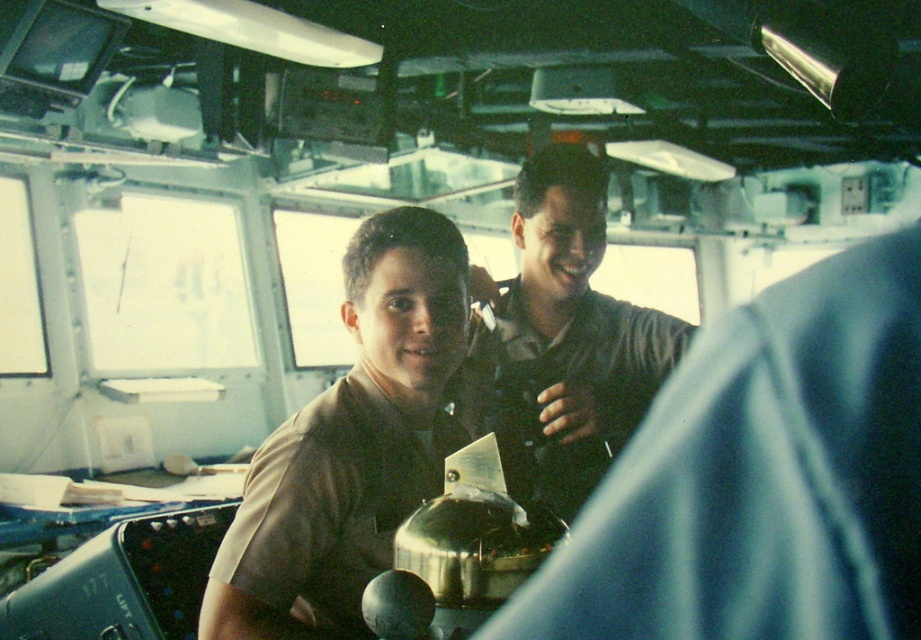
Question: Does matte brown shirt at center have a smaller size compared to dark brown uniform at center?

Choices:
 (A) yes
 (B) no

Answer: (A)

Question: Which point is closer to the camera taking this photo?

Choices:
 (A) (540, 269)
 (B) (356, 330)
 (C) (616, 362)

Answer: (B)

Question: Which object appears farthest from the camera in this image?

Choices:
 (A) dark brown uniform at center
 (B) matte brown shirt at center

Answer: (B)

Question: Considering the relative positions of brown uniform at center and matte brown shirt at center in the image provided, where is brown uniform at center located with respect to matte brown shirt at center?

Choices:
 (A) left
 (B) right

Answer: (B)

Question: Can you confirm if brown uniform at center is positioned above matte brown shirt at center?

Choices:
 (A) yes
 (B) no

Answer: (A)

Question: Which point is farther to the camera?

Choices:
 (A) matte brown shirt at center
 (B) brown uniform at center
 (C) dark brown uniform at center

Answer: (A)